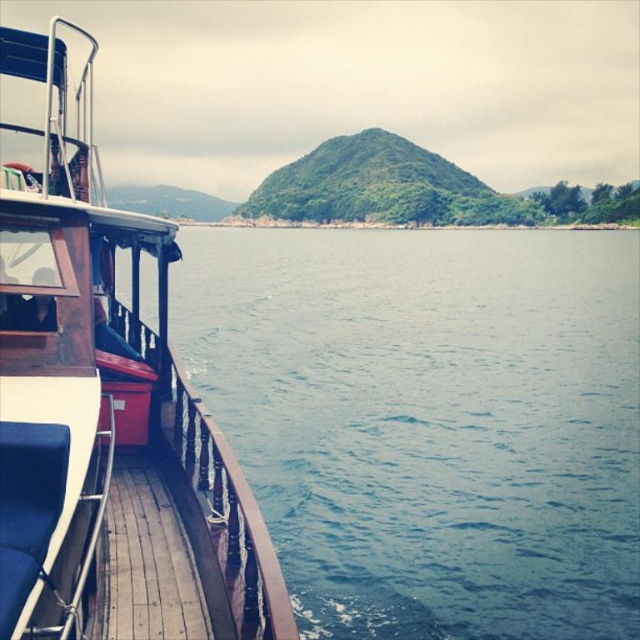
Question: Among these points, which one is farthest from the camera?

Choices:
 (A) (186, 284)
 (B) (125, 417)

Answer: (A)

Question: Which point is closer to the camera?

Choices:
 (A) wooden deck boat at left
 (B) wooden at left
 (C) blue water at lower left

Answer: (A)

Question: Does wooden rail at lower left have a lesser width compared to wooden at left?

Choices:
 (A) no
 (B) yes

Answer: (B)

Question: Where is blue water at lower left located in relation to wooden rail at lower left in the image?

Choices:
 (A) above
 (B) below

Answer: (A)

Question: Among these points, which one is nearest to the camera?

Choices:
 (A) (605, 532)
 (B) (248, 560)
 (C) (20, 225)
 (D) (97, 596)

Answer: (B)

Question: Does wooden deck boat at left appear over wooden at left?

Choices:
 (A) yes
 (B) no

Answer: (A)